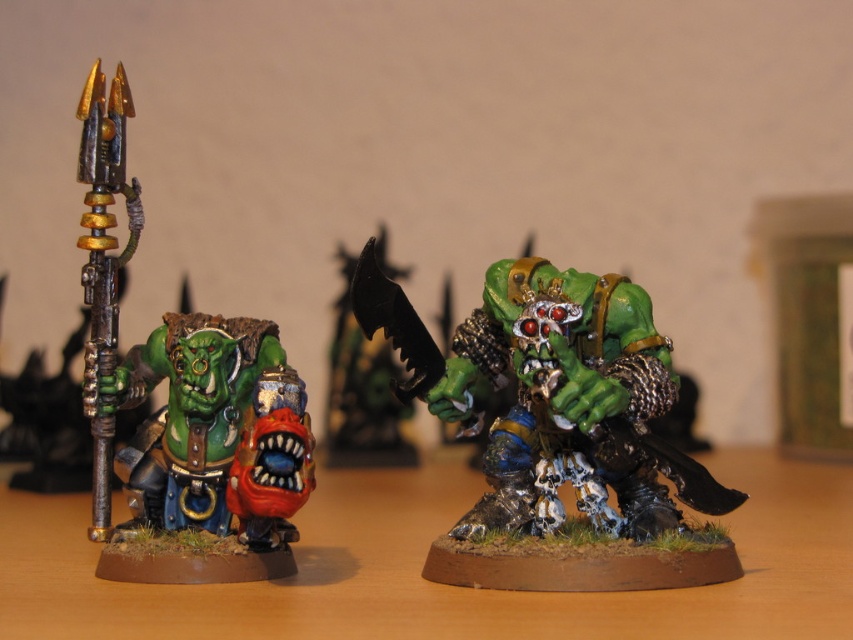
Where is the green metallic armor at center located in the image?

The green metallic armor at center is located at point coordinates of (558, 432).

You are a miniature painter who needs to fit both the green metallic armor at center and the green matte orc head at center into a display case that can only accommodate items up to the size of the larger object. Which object determines the maximum size the case must be?

The green metallic armor at center determines the maximum size the case must be because its width is larger than the green matte orc head at center.